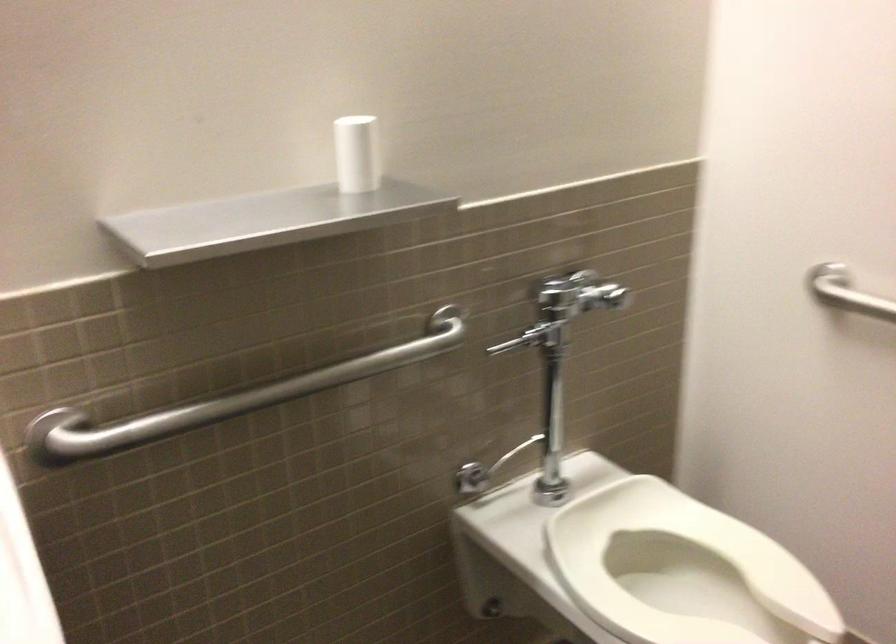
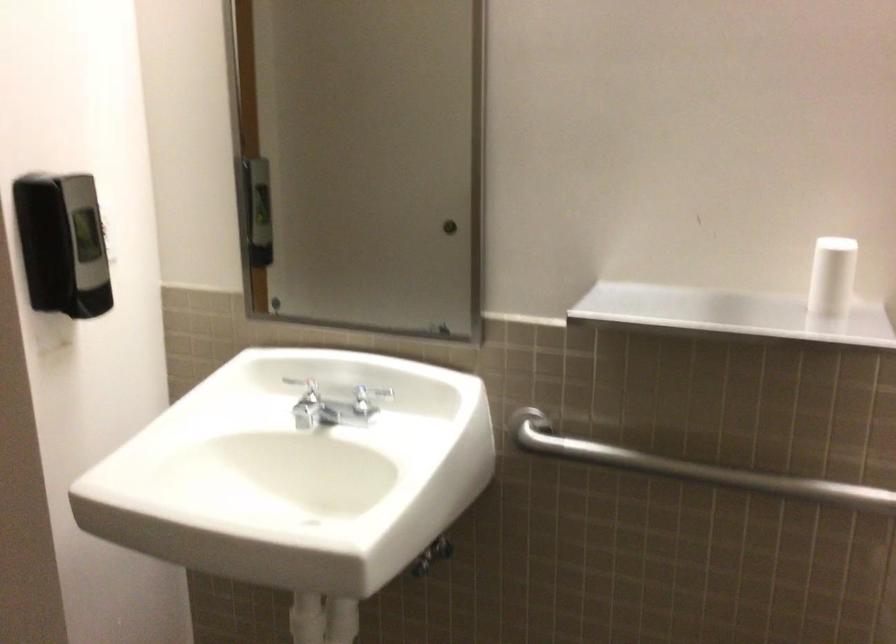
Locate, in the second image, the point that corresponds to (x=285, y=395) in the first image.

(691, 468)